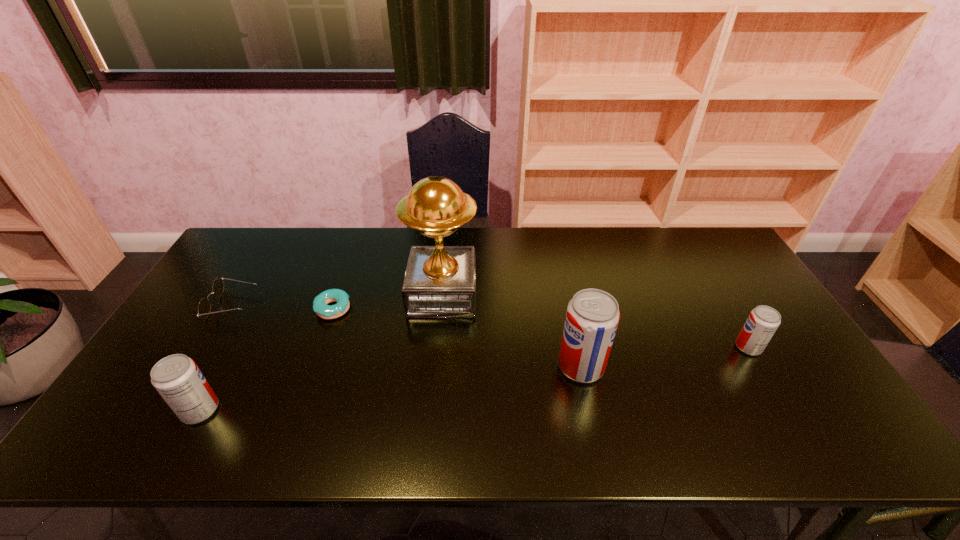
This screenshot has height=540, width=960. I want to click on free space that satisfies the following two spatial constraints: 1. on the front-facing side of the second tallest object; 2. on the right side of the second shortest object, so click(x=196, y=366).

Identify the location of vacant region that satisfies the following two spatial constraints: 1. on the front-facing side of the rightmost object; 2. on the left side of the third object from right to left. (438, 347).

The width and height of the screenshot is (960, 540). In order to click on blank area in the image that satisfies the following two spatial constraints: 1. on the front-facing side of the third object from right to left; 2. on the left side of the rightmost soda in this screenshot , I will do `click(438, 347)`.

Locate an element on the screen. The image size is (960, 540). free point that satisfies the following two spatial constraints: 1. on the front-facing side of the fourth tallest object; 2. on the left side of the second shortest object is located at coordinates click(207, 347).

What are the coordinates of `free spot that satisfies the following two spatial constraints: 1. on the front-facing side of the second tallest object; 2. on the right side of the spectacles` in the screenshot? It's located at (196, 366).

Locate an element on the screen. vacant space that satisfies the following two spatial constraints: 1. on the front-facing side of the spectacles; 2. on the right side of the nearest object is located at coordinates (170, 410).